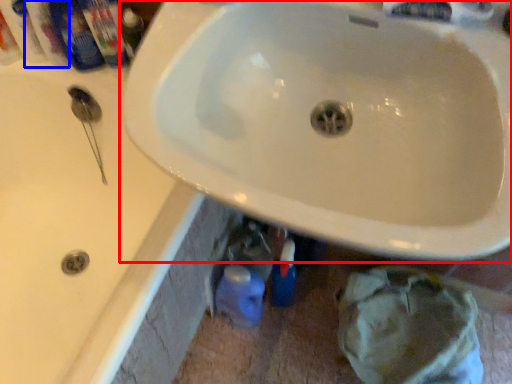
Question: Which object appears closest to the camera in this image, sink (highlighted by a red box) or mouthwash (highlighted by a blue box)?

Choices:
 (A) sink
 (B) mouthwash

Answer: (A)